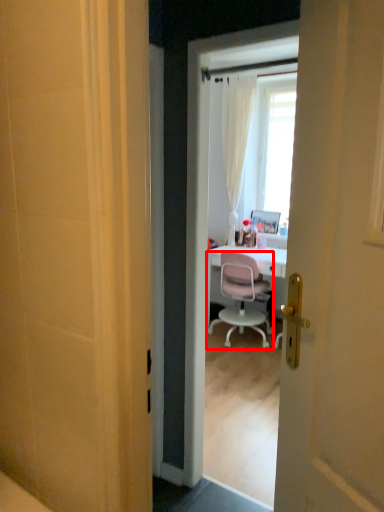
Question: Observing the image, what is the correct spatial positioning of chair (annotated by the red box) in reference to picture frame?

Choices:
 (A) left
 (B) right

Answer: (A)